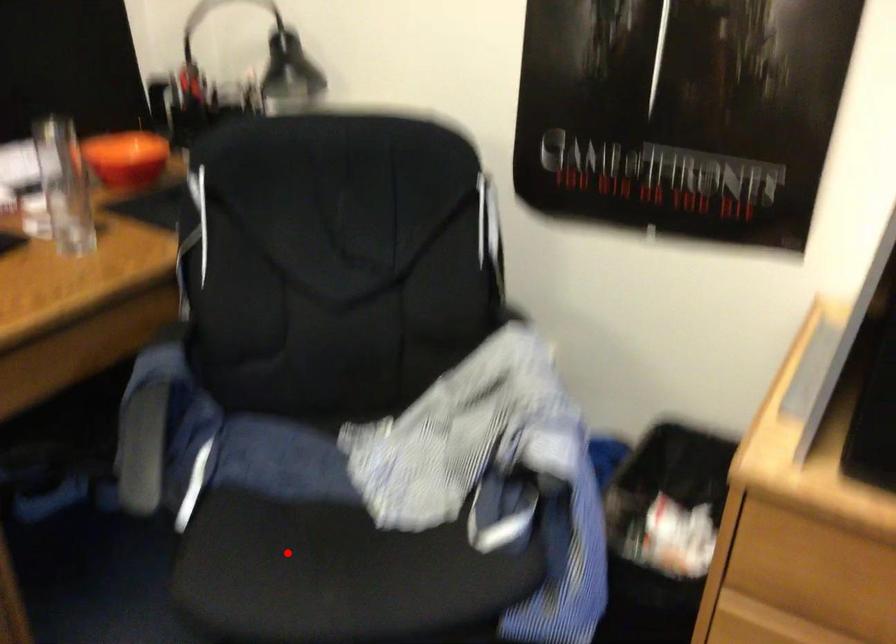
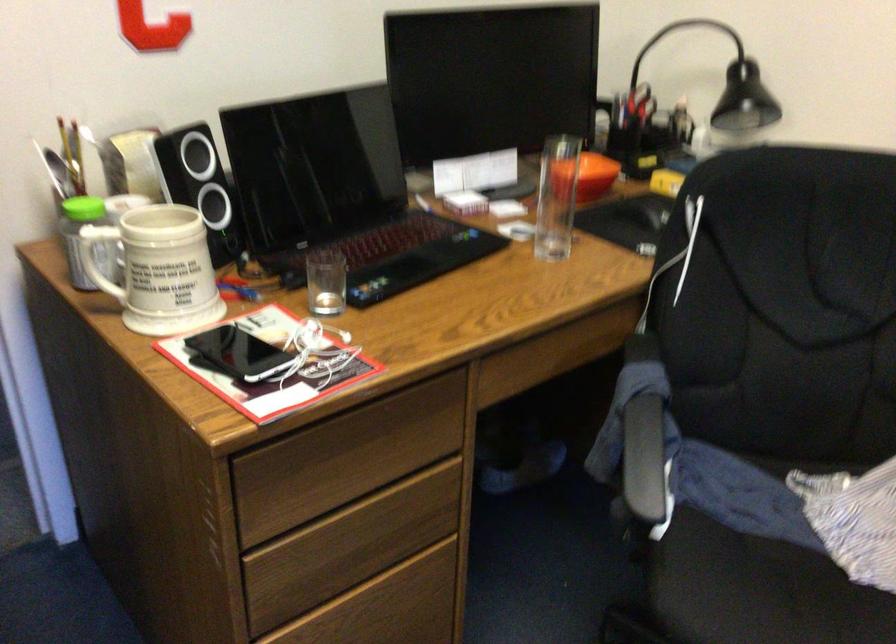
Find the pixel in the second image that matches the highlighted location in the first image.

(757, 591)